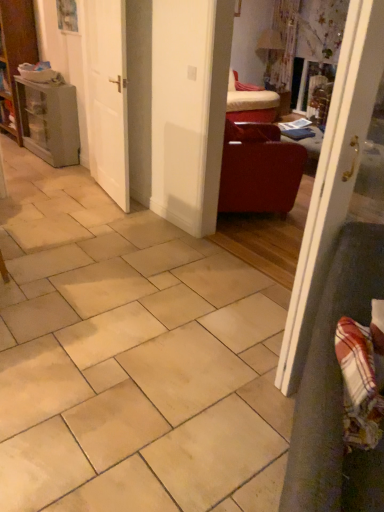
Locate an element on the screen. free space in front of white matte door at center, which ranks as the 1th door in back-to-front order is located at coordinates (97, 218).